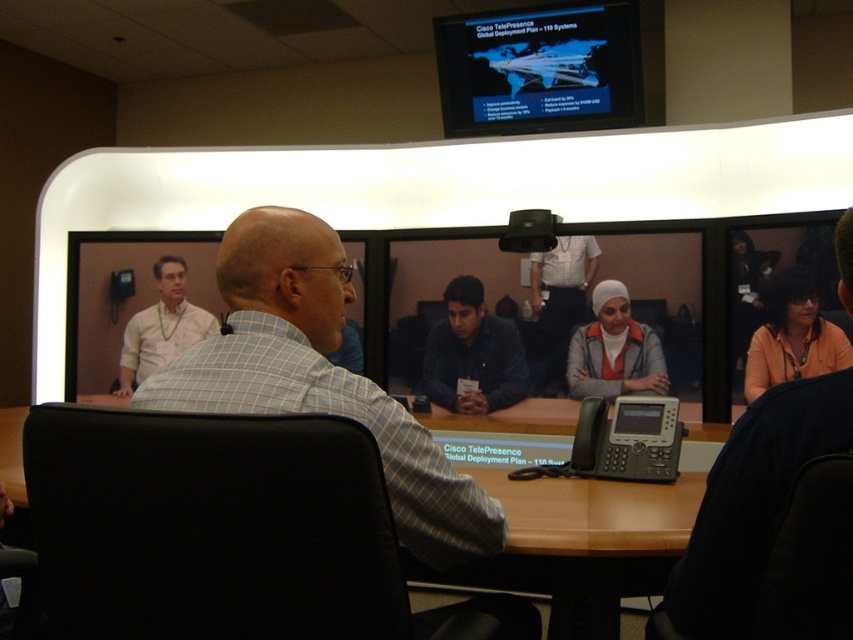
Question: Does gray checkered shirt at center appear on the right side of black plastic projector at center?

Choices:
 (A) no
 (B) yes

Answer: (A)

Question: Among these objects, which one is farthest from the camera?

Choices:
 (A) matte black screen at upper center
 (B) orange fabric shirt at lower right
 (C) gray checkered shirt at center

Answer: (A)

Question: Can you confirm if gray checkered shirt at center is thinner than matte black shirt at center?

Choices:
 (A) yes
 (B) no

Answer: (B)

Question: Does matte black shirt at center have a larger size compared to black plastic projector at center?

Choices:
 (A) no
 (B) yes

Answer: (B)

Question: Which object is closer to the camera taking this photo?

Choices:
 (A) brown wooden table at center
 (B) matte black shirt at center

Answer: (A)

Question: Which object is closer to the camera taking this photo?

Choices:
 (A) dark blue shirt at center
 (B) matte gray jacket at center

Answer: (B)